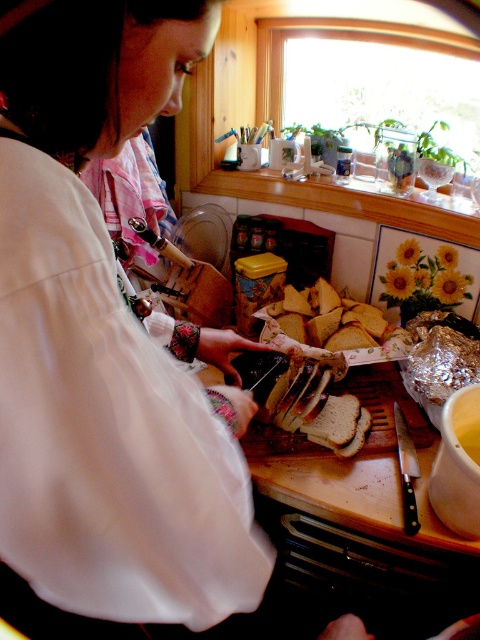
Can you confirm if white matte shirt at center is positioned below wooden at center?

No, white matte shirt at center is not below wooden at center.

Does white matte shirt at center appear on the right side of wooden at center?

No, white matte shirt at center is not to the right of wooden at center.

The image size is (480, 640). Identify the location of white matte shirt at center. (108, 342).